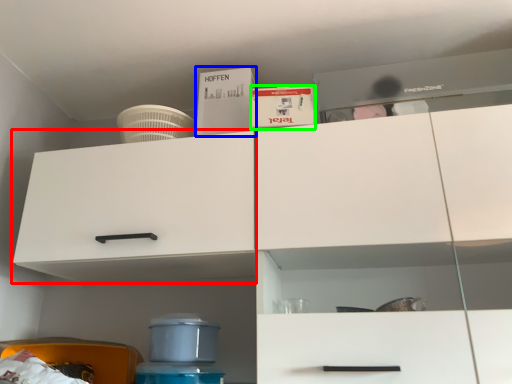
Question: Based on their relative distances, which object is nearer to cabinetry (highlighted by a red box)? Choose from box (highlighted by a blue box) and box (highlighted by a green box).

Choices:
 (A) box
 (B) box

Answer: (A)